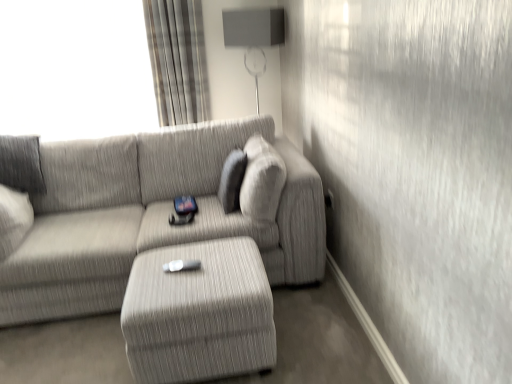
The height and width of the screenshot is (384, 512). Find the location of `space that is in front of white matte wii controller at center`. space that is in front of white matte wii controller at center is located at coordinates (180, 289).